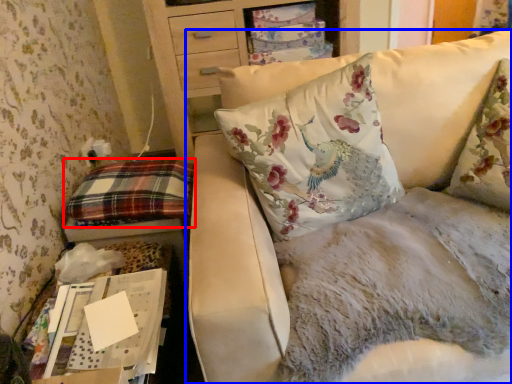
Question: Which point is further to the camera, pillow (highlighted by a red box) or studio couch (highlighted by a blue box)?

Choices:
 (A) pillow
 (B) studio couch

Answer: (A)